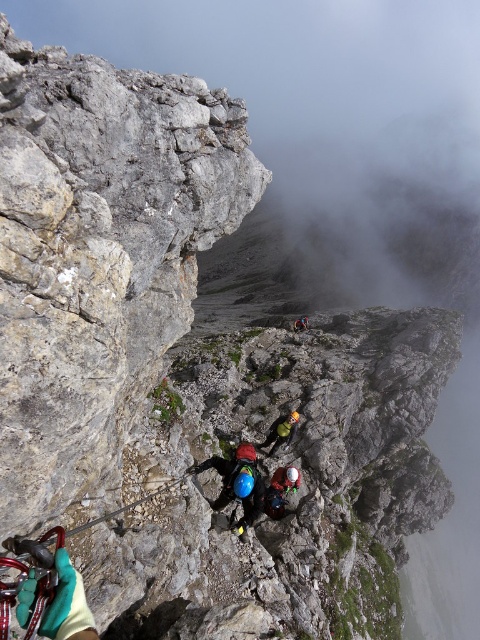
Question: Which of the following is the closest to the observer?

Choices:
 (A) green fabric helmet at center
 (B) red helmet at center

Answer: (A)

Question: Does matte blue helmet at center appear over green fabric helmet at center?

Choices:
 (A) no
 (B) yes

Answer: (A)

Question: Is green fabric helmet at center to the left of red helmet at center from the viewer's perspective?

Choices:
 (A) yes
 (B) no

Answer: (A)

Question: Estimate the real-world distances between objects in this image. Which object is closer to the red helmet at center?

Choices:
 (A) green fabric helmet at center
 (B) matte blue helmet at center

Answer: (A)

Question: Which point appears farthest from the camera in this image?

Choices:
 (A) (302, 316)
 (B) (279, 444)
 (C) (288, 490)

Answer: (A)

Question: Is matte blue helmet at center further to camera compared to green fabric helmet at center?

Choices:
 (A) no
 (B) yes

Answer: (A)